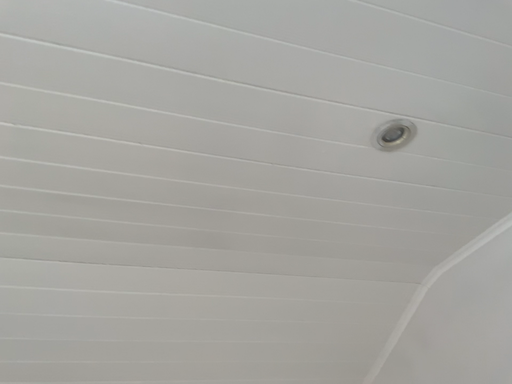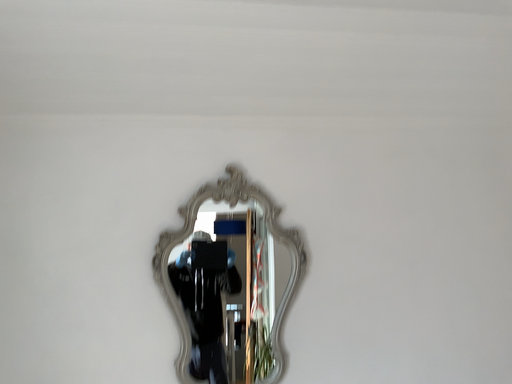
Question: Which way did the camera rotate in the video?

Choices:
 (A) rotated downward
 (B) rotated upward

Answer: (A)